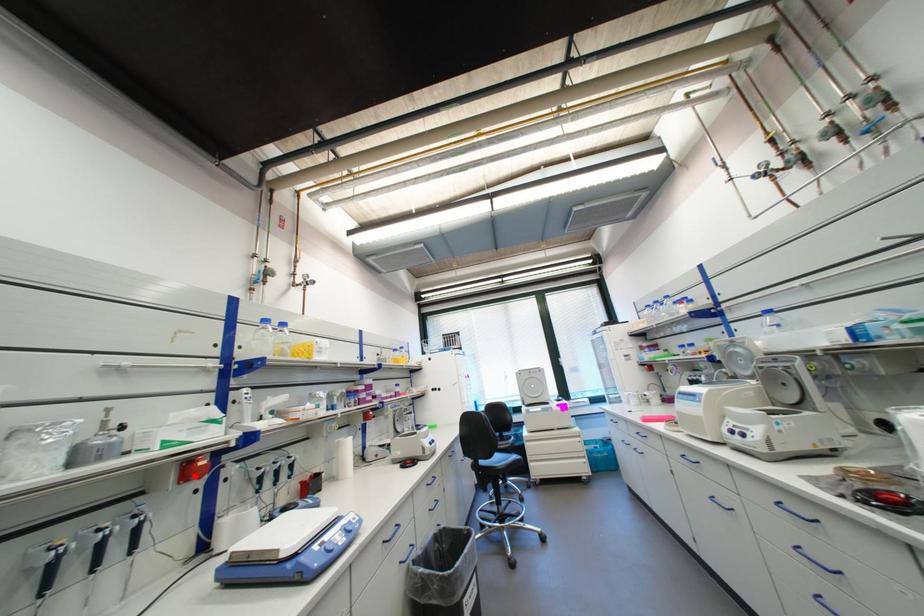
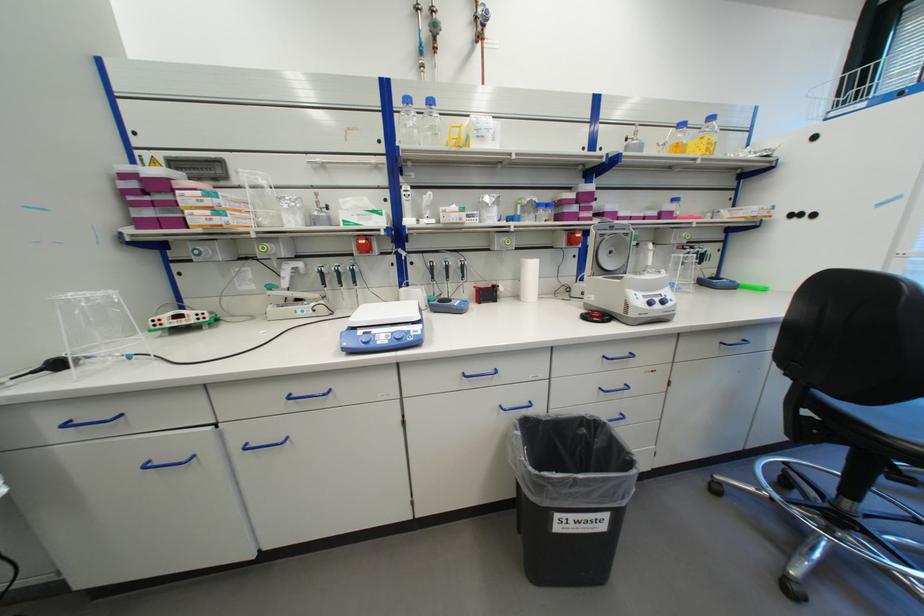
Locate, in the second image, the point that corresponds to the highlighted location in the first image.

(373, 249)